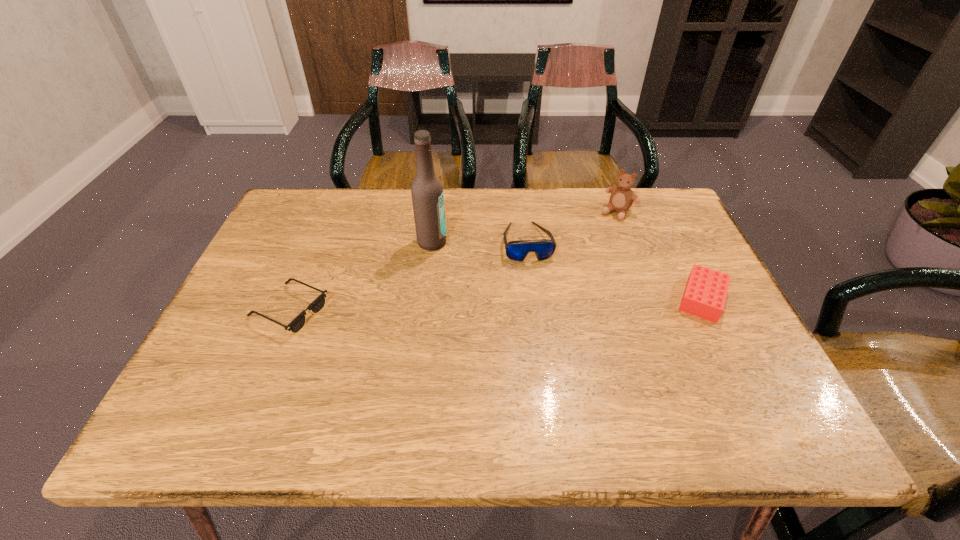
You are a GUI agent. You are given a task and a screenshot of the screen. Output one action in this format:
    pyautogui.click(x=<x>, y=<y>)
    Task: Click on the vacant space on the desktop that is between the nearer sunglasses and the Lego and is positioned on the side of the tallest object with the label
    
    Given the screenshot: What is the action you would take?
    pyautogui.click(x=549, y=303)

Identify the location of vacant space on the desktop that is between the shortest object and the second shortest object and is positioned on the front-facing side of the fourth shortest object. (540, 303).

The image size is (960, 540). What are the coordinates of `vacant space on the desktop that is between the shorter sunglasses and the Lego and is positioned on the front-facing side of the farther sunglasses` in the screenshot? It's located at (541, 303).